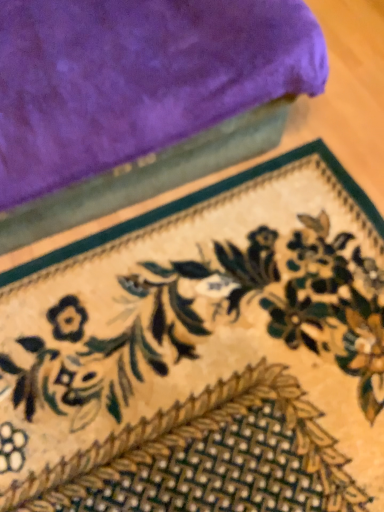
In order to click on vacant point above floral-patterned carpet at lower center (from a real-world perspective) in this screenshot , I will do `click(210, 349)`.